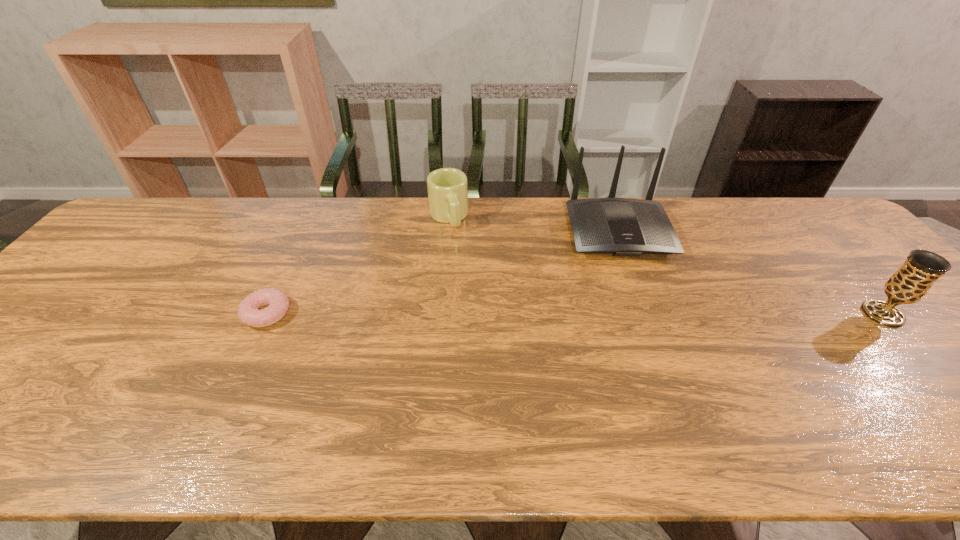
Image resolution: width=960 pixels, height=540 pixels. In the image, there is a desktop. In order to click on vacant space at the near edge in this screenshot , I will do `click(516, 389)`.

This screenshot has height=540, width=960. Find the location of `vacant area at the left edge of the desktop`. vacant area at the left edge of the desktop is located at coordinates (69, 297).

Identify the location of blank space at the far left corner of the desktop. The image size is (960, 540). (146, 205).

Where is `free space between the leftmost object and the second object from left to right`? The image size is (960, 540). free space between the leftmost object and the second object from left to right is located at coordinates (358, 265).

Locate an element on the screen. The width and height of the screenshot is (960, 540). free space between the third object from right to left and the leftmost object is located at coordinates click(358, 265).

Where is `unoccupied area between the rightmost object and the second object from left to right`? This screenshot has width=960, height=540. unoccupied area between the rightmost object and the second object from left to right is located at coordinates (665, 266).

Identify the location of empty location between the chalice and the doughnut. (575, 314).

Locate an element on the screen. Image resolution: width=960 pixels, height=540 pixels. free space between the tallest object and the chalice is located at coordinates (750, 273).

Image resolution: width=960 pixels, height=540 pixels. What are the coordinates of `free point between the shortest object and the third shortest object` in the screenshot? It's located at (575, 314).

Where is `vacant area that lies between the mug and the rightmost object`? vacant area that lies between the mug and the rightmost object is located at coordinates (665, 266).